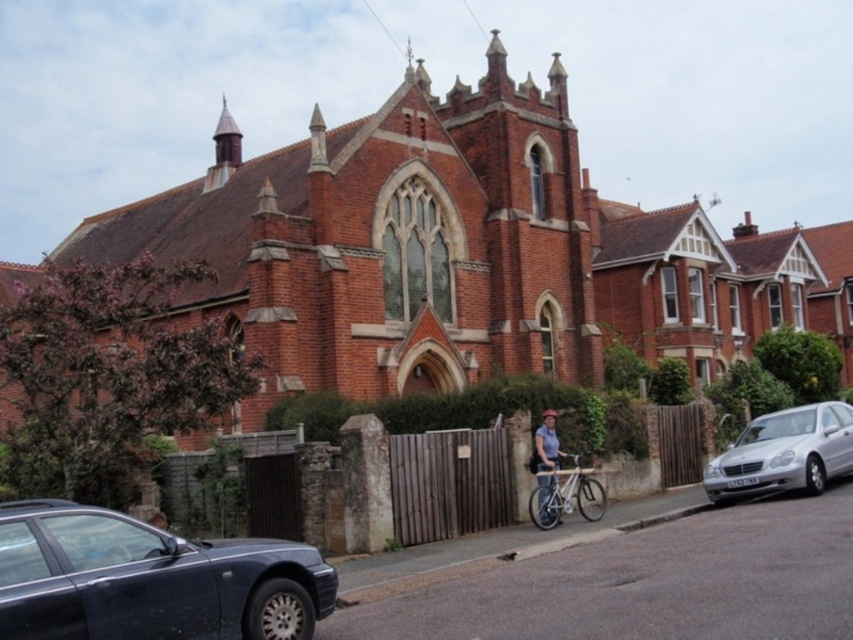
Question: Which of these objects is positioned closest to the light brown wooden bicycle at center?

Choices:
 (A) silver metallic car at right
 (B) shiny dark blue sedan at lower left

Answer: (A)

Question: Does silver metallic car at right appear over silver metallic bicycle at center?

Choices:
 (A) no
 (B) yes

Answer: (B)

Question: Which object is farther from the camera taking this photo?

Choices:
 (A) light brown wooden bicycle at center
 (B) silver metallic bicycle at center
 (C) shiny dark blue sedan at lower left

Answer: (A)

Question: Can you confirm if red brick church at center is bigger than light brown wooden bicycle at center?

Choices:
 (A) yes
 (B) no

Answer: (A)

Question: Which object is closer to the camera taking this photo?

Choices:
 (A) light brown wooden bicycle at center
 (B) silver metallic car at right
 (C) silver metallic bicycle at center
 (D) shiny dark blue sedan at lower left

Answer: (D)

Question: Is silver metallic car at right to the right of silver metallic bicycle at center from the viewer's perspective?

Choices:
 (A) yes
 (B) no

Answer: (A)